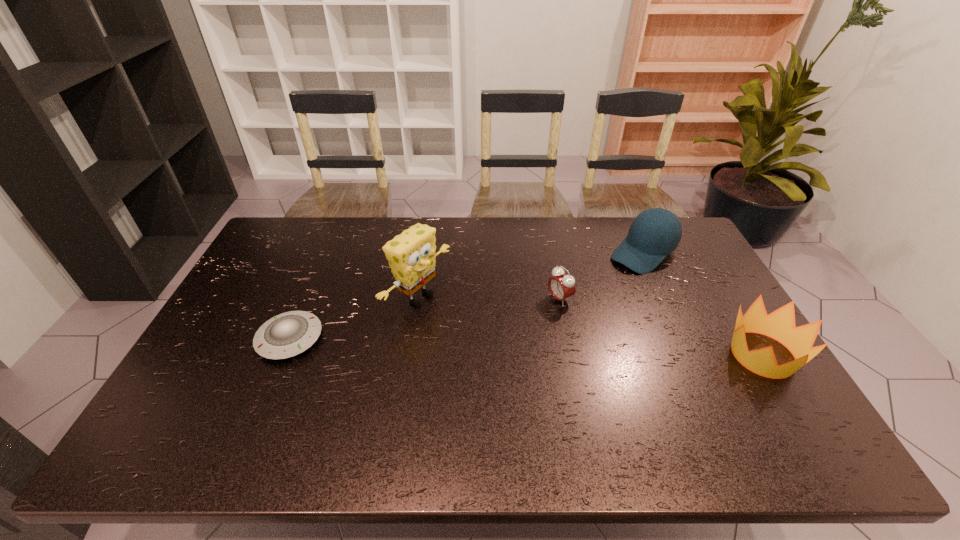
Image resolution: width=960 pixels, height=540 pixels. What are the coordinates of `object positioned at the left edge` in the screenshot? It's located at (286, 335).

Locate an element on the screen. crown that is at the right edge is located at coordinates (780, 325).

Locate an element on the screen. baseball cap at the right edge is located at coordinates (656, 232).

Identify the location of object that is at the far right corner. (656, 232).

What are the coordinates of `object positioned at the near right corner` in the screenshot? It's located at (780, 325).

You are a GUI agent. You are given a task and a screenshot of the screen. Output one action in this format:
    pyautogui.click(x=<x>, y=<y>)
    Task: Click on the vacant space at the far edge of the desktop
    
    Given the screenshot: What is the action you would take?
    pyautogui.click(x=360, y=225)

Image resolution: width=960 pixels, height=540 pixels. I want to click on vacant region at the near edge, so click(694, 395).

Where is `vacant space at the right edge of the desktop`? vacant space at the right edge of the desktop is located at coordinates (710, 321).

In the image, there is a desktop. Where is `vacant space at the far right corner`? The image size is (960, 540). vacant space at the far right corner is located at coordinates (696, 255).

In the image, there is a desktop. Identify the location of vacant space at the near right corner. (776, 414).